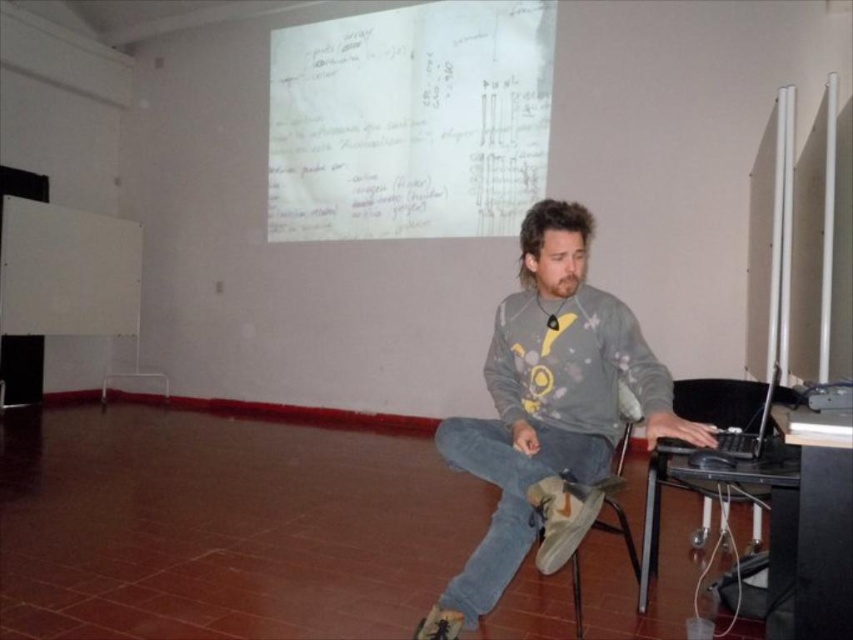
Who is taller, gray cotton sweatshirt at center or black matte laptop at right?

With more height is gray cotton sweatshirt at center.

Can you confirm if gray cotton sweatshirt at center is thinner than black matte laptop at right?

Incorrect, gray cotton sweatshirt at center's width is not less than black matte laptop at right's.

Find the location of `gray cotton sweatshirt at center`. gray cotton sweatshirt at center is located at coordinates (549, 412).